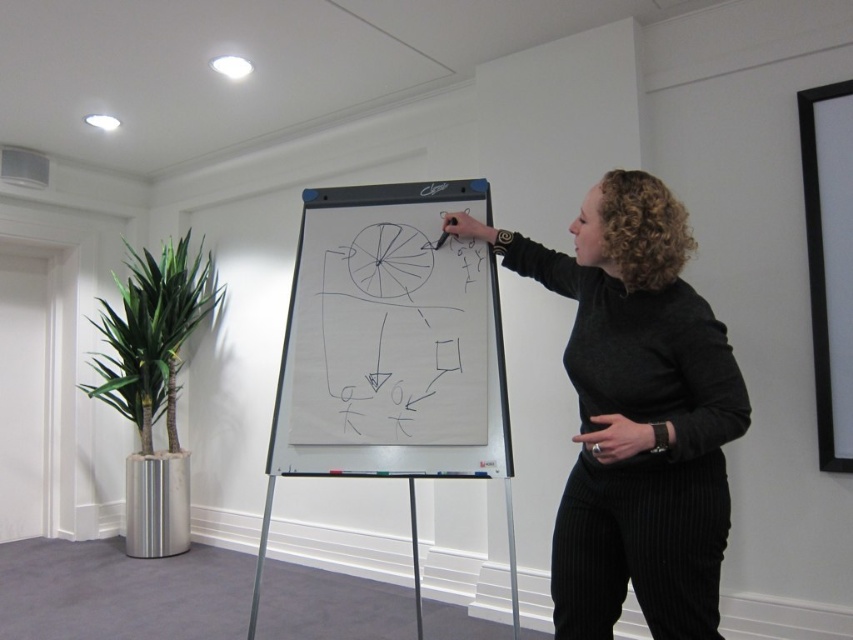
Which of these two, black matte sweater at center or whiteboard at center, stands taller?

With more height is whiteboard at center.

Between black matte sweater at center and whiteboard at center, which one appears on the left side from the viewer's perspective?

Positioned to the left is whiteboard at center.

Which is in front, point (662, 326) or point (471, 456)?

Positioned in front is point (662, 326).

The height and width of the screenshot is (640, 853). Find the location of `black matte sweater at center`. black matte sweater at center is located at coordinates (636, 413).